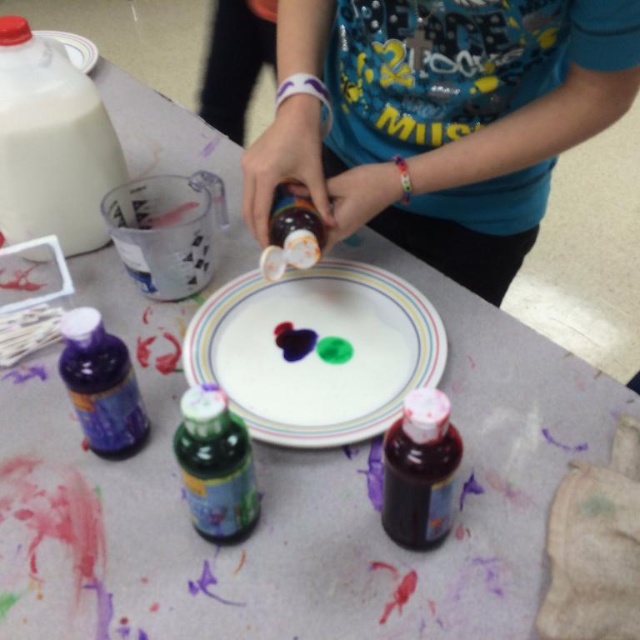
Is the position of satin dark red bottle at center less distant than that of translucent green bottle at center?

Yes.

Between point (413, 396) and point (237, 484), which one is positioned behind?

The point (237, 484) is more distant.

Who is more forward, (394, 506) or (218, 413)?

Point (218, 413)

Image resolution: width=640 pixels, height=640 pixels. What are the coordinates of `satin dark red bottle at center` in the screenshot? It's located at (419, 470).

Does white matte plastic jug at upper left appear over satin dark red bottle at center?

Indeed, white matte plastic jug at upper left is positioned over satin dark red bottle at center.

Is point (58, 124) more distant than point (424, 397)?

Yes, it is.

The height and width of the screenshot is (640, 640). I want to click on white matte plastic jug at upper left, so click(51, 145).

The height and width of the screenshot is (640, 640). What do you see at coordinates (440, 118) in the screenshot? I see `shiny plastic bottle at center` at bounding box center [440, 118].

At what (x,y) coordinates should I click in order to perform the action: click on shiny plastic bottle at center. Please return your answer as a coordinate pair (x, y). Looking at the image, I should click on (440, 118).